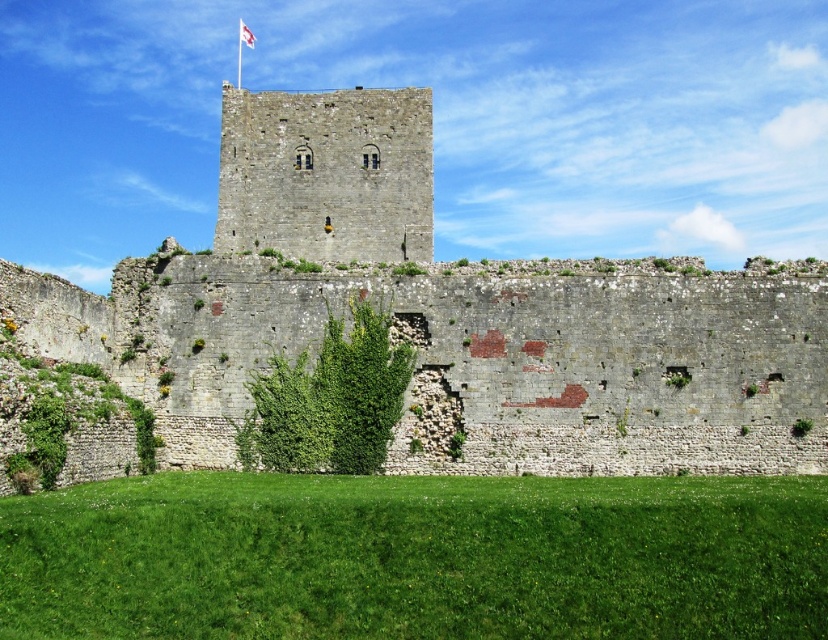
You are standing at the entrance of the historic stone structure and want to locate the gray stone wall at center. Based on its coordinates, where should you look?

The gray stone wall at center is located at coordinates point (443, 316), which is near the center of the image.

You are a drone operator planning to fly a drone from the point at coordinates point (326, 173) to the flagpole on the tower. According to the image description, will the drone have a clear path to the flagpole without obstacles?

The point (326, 173) is on the gray stone tower at center, so the drone can fly directly to the flagpole on the tower since they are on the same structure and there are no mentioned obstacles between them.